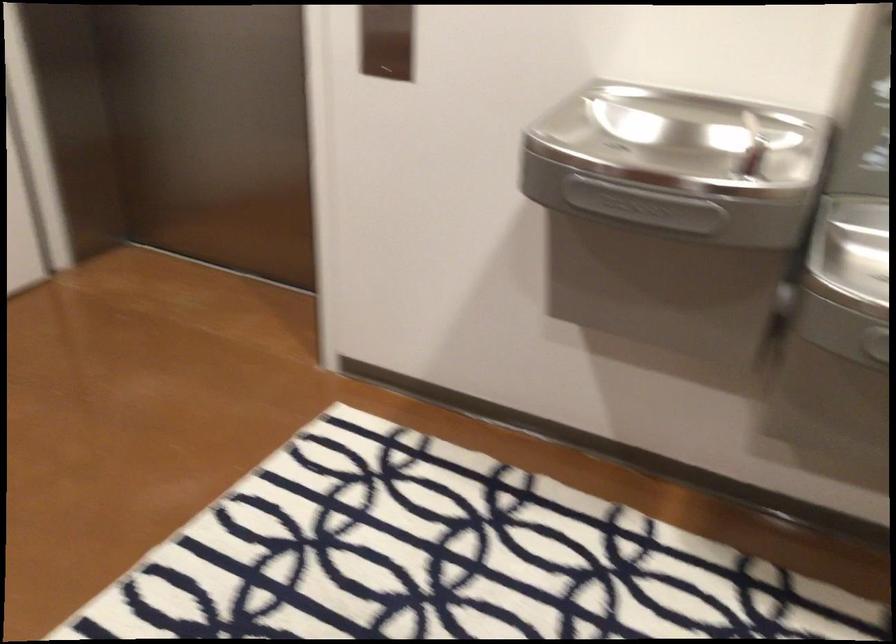
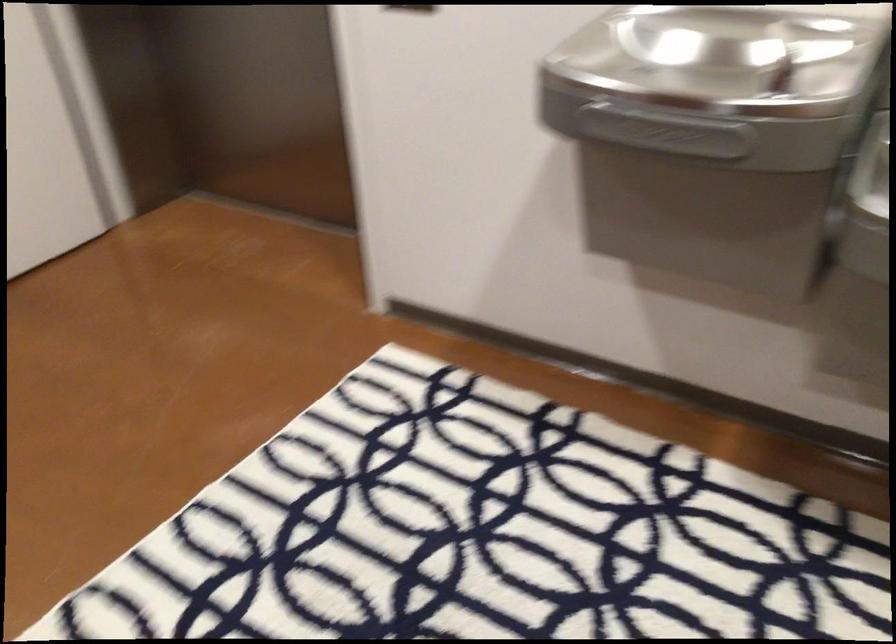
Question: The camera is either moving clockwise (left) or counter-clockwise (right) around the object. The first image is from the beginning of the video and the second image is from the end. Is the camera moving left or right when shooting the video?

Choices:
 (A) Left
 (B) Right

Answer: (B)